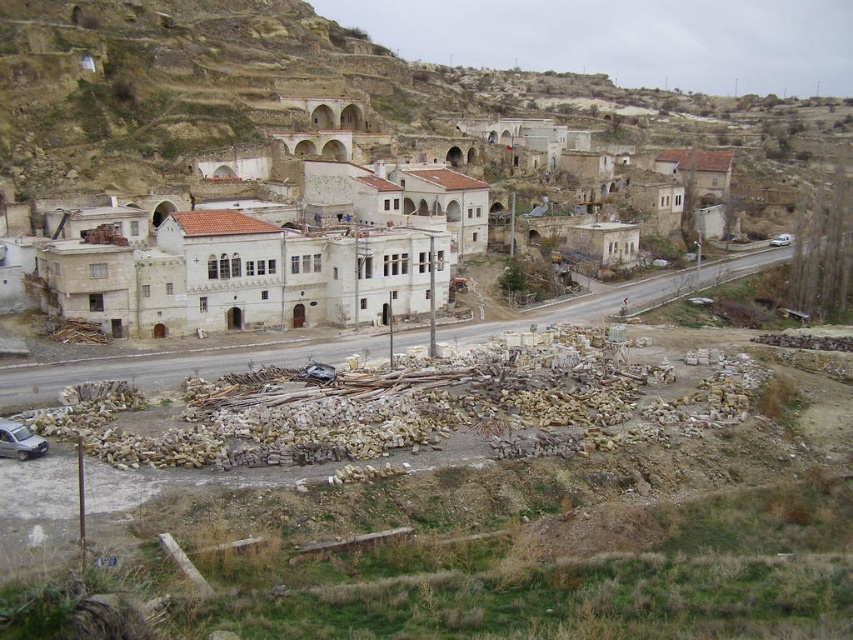
You are standing in the rural village and want to walk from point A to point B. Point A is at coordinate point (287,298) and point B is at coordinate point (10,440). Which point is closer to you when you start walking?

Point A at coordinate point (287,298) is closer to you than point B at coordinate point (10,440) because it is further to the viewer.